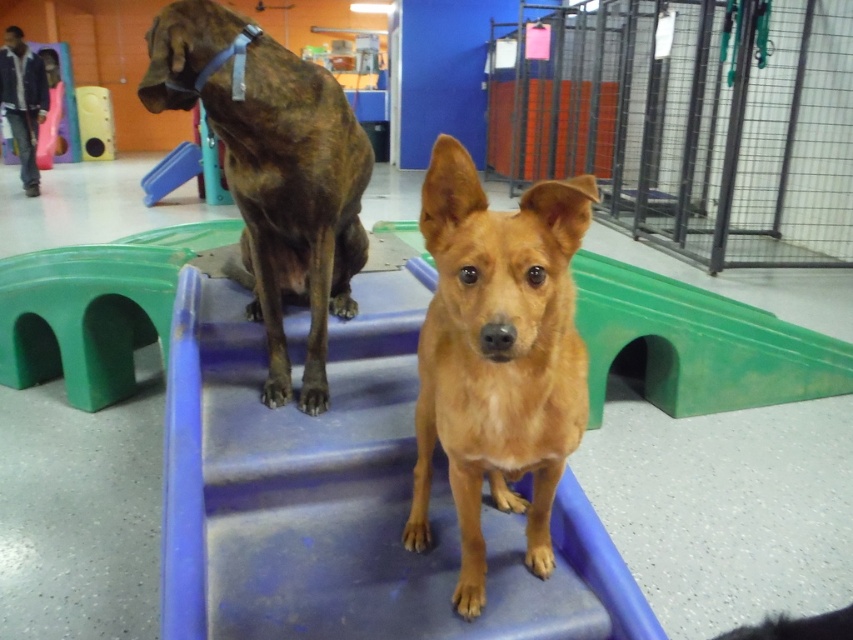
Between point (608, 577) and point (537, 186), which one is positioned behind?

Positioned behind is point (608, 577).

Consider the image. Is blue plastic stairs at center to the left of brown furry dog at center from the viewer's perspective?

Indeed, blue plastic stairs at center is positioned on the left side of brown furry dog at center.

At what (x,y) coordinates should I click in order to perform the action: click on blue plastic stairs at center. Please return your answer as a coordinate pair (x, y). Image resolution: width=853 pixels, height=640 pixels. Looking at the image, I should click on (343, 502).

Identify the location of blue plastic stairs at center. The image size is (853, 640). (343, 502).

Between blue plastic stairs at center and metallic wire cage at center right, which one appears on the left side from the viewer's perspective?

blue plastic stairs at center is more to the left.

I want to click on blue plastic stairs at center, so click(x=343, y=502).

Can you confirm if blue plastic stairs at center is thinner than blue plastic slide at upper center?

No, blue plastic stairs at center is not thinner than blue plastic slide at upper center.

Is blue plastic stairs at center to the right of blue plastic slide at upper center from the viewer's perspective?

Indeed, blue plastic stairs at center is positioned on the right side of blue plastic slide at upper center.

Describe the element at coordinates (343, 502) in the screenshot. I see `blue plastic stairs at center` at that location.

What are the coordinates of `blue plastic stairs at center` in the screenshot? It's located at 343,502.